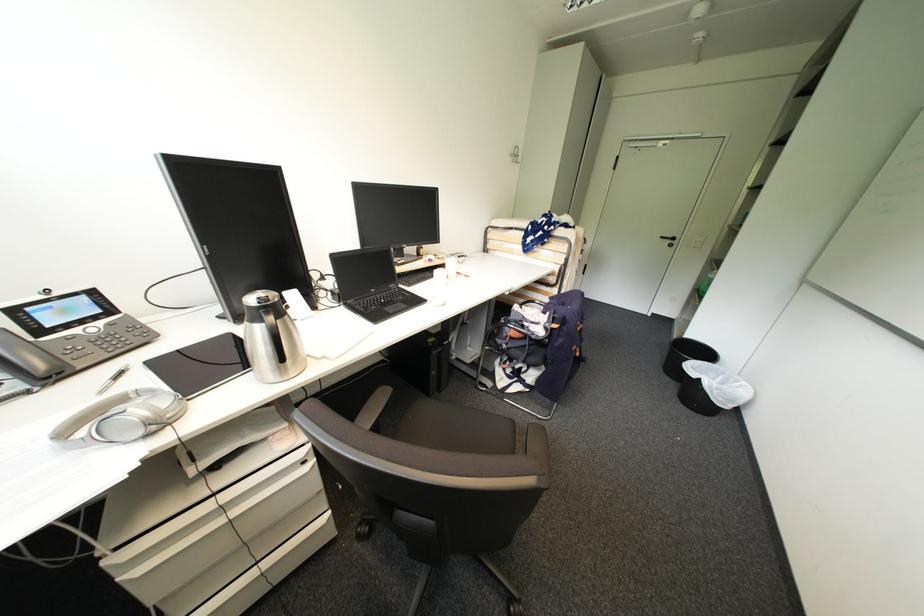
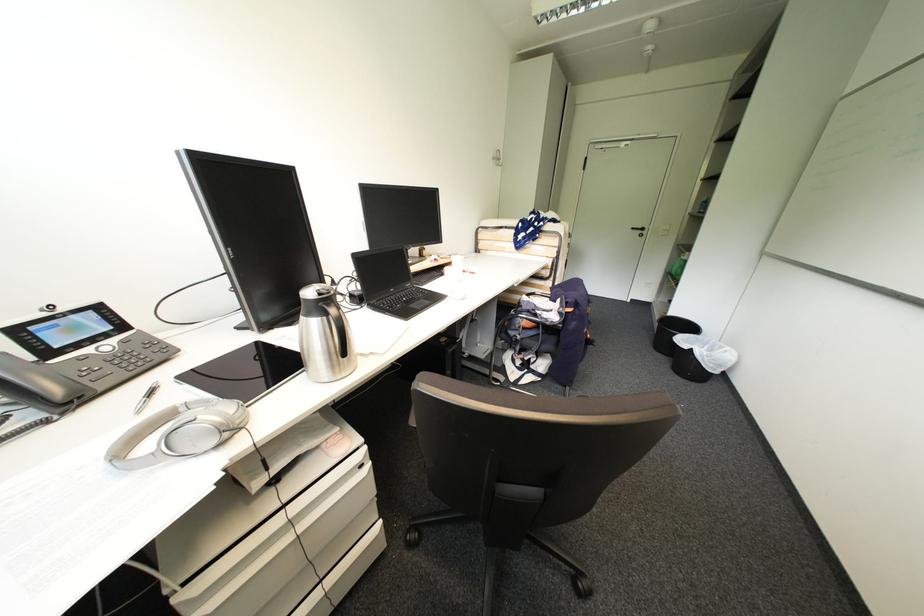
Where in the second image is the point corresponding to point 687,385 from the first image?

(677, 359)